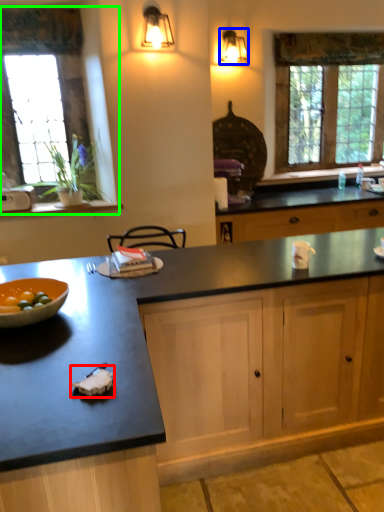
Question: Which object is the closest to the food (highlighted by a red box)? Choose among these: light fixture (highlighted by a blue box) or window (highlighted by a green box).

Choices:
 (A) light fixture
 (B) window

Answer: (B)